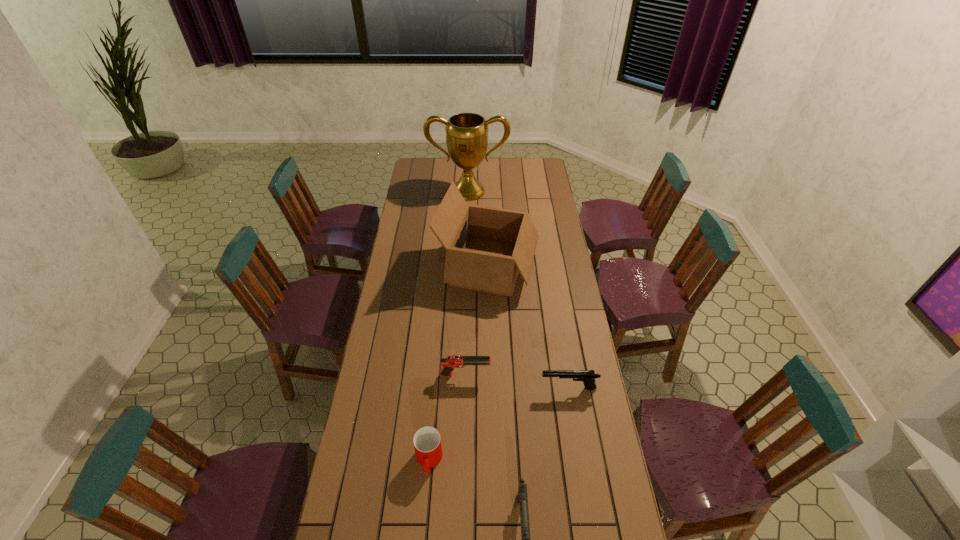
Locate an element on the screen. The image size is (960, 540). vacant space at the left edge of the desktop is located at coordinates tap(407, 192).

Identify the location of vacant space at the right edge of the desktop. (534, 181).

Locate an element on the screen. free space at the far left corner of the desktop is located at coordinates (415, 159).

Locate an element on the screen. free space between the cup and the fourth nearest object is located at coordinates (447, 418).

Identify the location of vacant space that is in between the fifth farthest object and the farthest gun. This screenshot has height=540, width=960. (447, 418).

This screenshot has width=960, height=540. In order to click on blank region between the fourth nearest object and the third nearest object in this screenshot , I will do `click(516, 382)`.

Where is `free space between the fifth shortest object and the fourth farthest object`? free space between the fifth shortest object and the fourth farthest object is located at coordinates (528, 327).

The image size is (960, 540). Find the location of `vacant point located between the farthest gun and the rightmost gun`. vacant point located between the farthest gun and the rightmost gun is located at coordinates (516, 382).

What are the coordinates of `empty location between the second nearest gun and the cup` in the screenshot? It's located at (499, 424).

This screenshot has width=960, height=540. In order to click on free point between the second tallest object and the leftmost gun in this screenshot , I will do `click(477, 321)`.